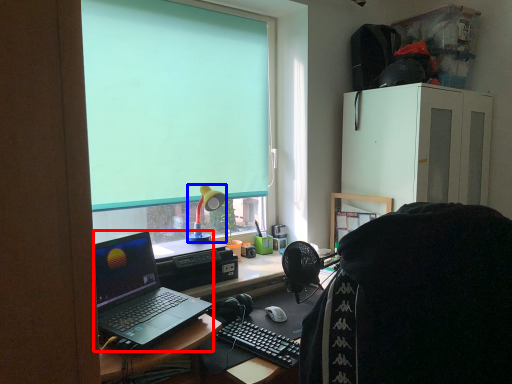
Question: Which object appears farthest to the camera in this image, laptop (highlighted by a red box) or lamp (highlighted by a blue box)?

Choices:
 (A) laptop
 (B) lamp

Answer: (B)